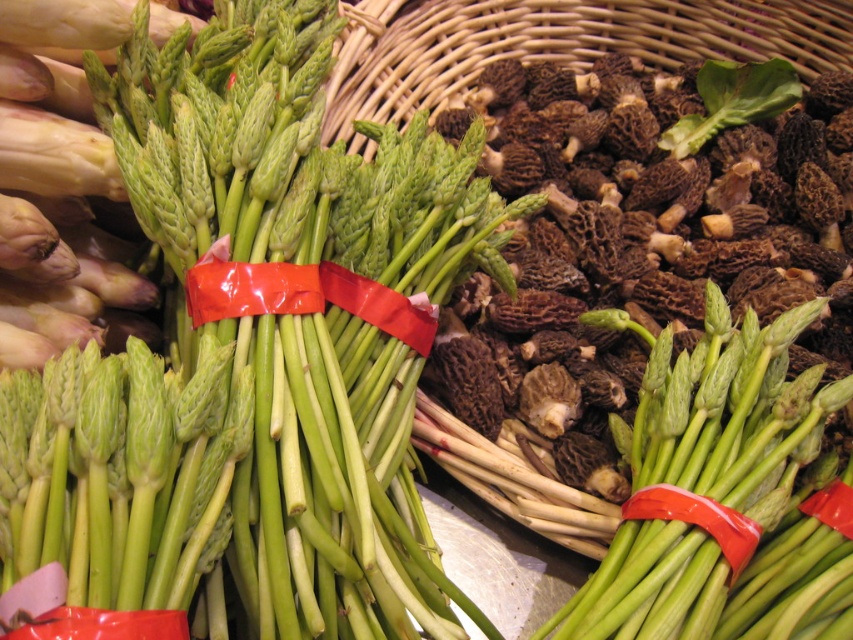
Consider the image. You are a customer at the vegetable stall and want to know which item is placed higher between the red plastic ribbon at center and the red rubber band at center. Which one is higher?

The red plastic ribbon at center is above the red rubber band at center, so the red plastic ribbon at center is placed higher.

You are a customer at the market stall looking at the bundles of asparagus. You notice a point marked at coordinates (303,296). Can you tell me what object this point is located on?

The point at coordinates (303,296) is on the red plastic ribbon at center.